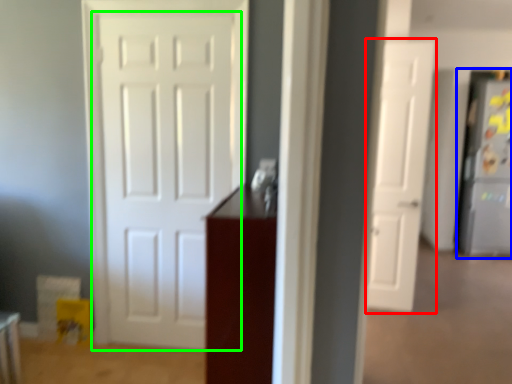
Question: Based on their relative distances, which object is nearer to door (highlighted by a red box)? Choose from fridge (highlighted by a blue box) and door (highlighted by a green box).

Choices:
 (A) fridge
 (B) door

Answer: (B)